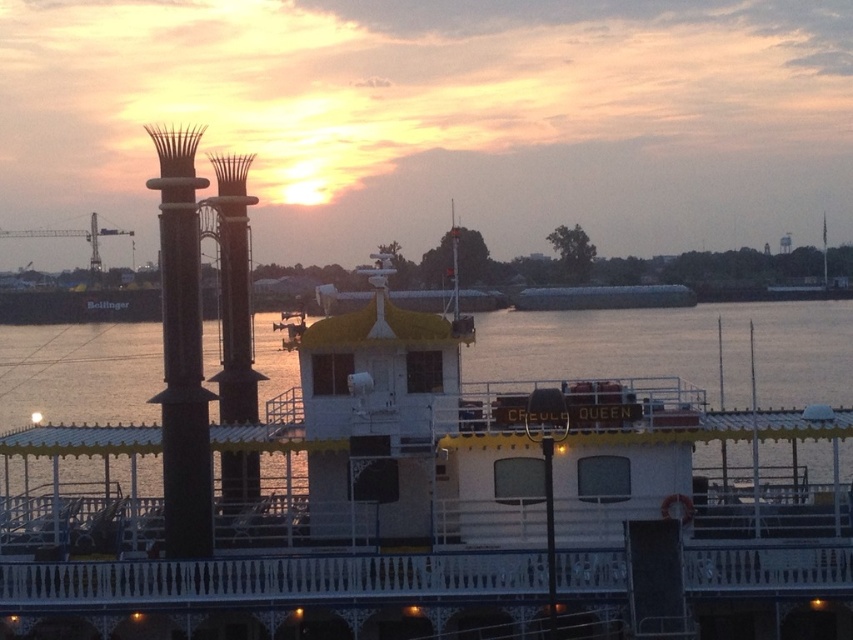
Question: Can you confirm if polished brass column at center is positioned to the left of brown wood pillar at center?

Choices:
 (A) no
 (B) yes

Answer: (A)

Question: Which point is farther from the camera taking this photo?

Choices:
 (A) (741, 378)
 (B) (341, 356)

Answer: (A)

Question: Is white wooden boat at center wider than brown wood pillar at center?

Choices:
 (A) no
 (B) yes

Answer: (B)

Question: Is polished brass column at center smaller than brown wood pillar at center?

Choices:
 (A) yes
 (B) no

Answer: (A)

Question: Which point appears closest to the camera in this image?

Choices:
 (A) pos(170,356)
 (B) pos(583,371)
 (C) pos(230,160)
 (D) pos(740,420)

Answer: (A)

Question: Which object appears farthest from the camera in this image?

Choices:
 (A) white wooden river at center
 (B) polished brass column at center
 (C) brown wood pillar at center
 (D) white wooden boat at center

Answer: (C)